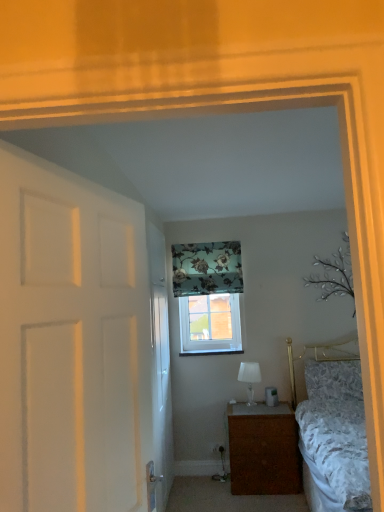
Where is `free space to the right of white glossy door at center, which is counted as the first door, starting from the back`? This screenshot has height=512, width=384. free space to the right of white glossy door at center, which is counted as the first door, starting from the back is located at coordinates (185, 489).